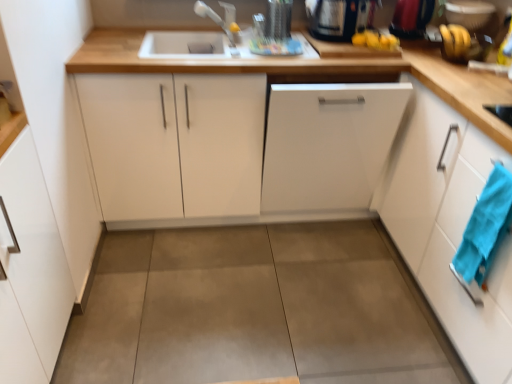
Question: From a real-world perspective, is white matte dishwasher at center, positioned as the 2th cabinetry in right-to-left order, above or below white glossy cabinet at right, arranged as the fourth cabinetry when viewed from the left?

Choices:
 (A) below
 (B) above

Answer: (A)

Question: From their relative heights in the image, would you say white matte dishwasher at center, the third cabinetry viewed from the left, is taller or shorter than white glossy cabinet at right, arranged as the fourth cabinetry when viewed from the left?

Choices:
 (A) short
 (B) tall

Answer: (A)

Question: Considering the real-world distances, which object is closest to the white matte dishwasher at center, positioned as the 2th cabinetry in right-to-left order?

Choices:
 (A) white glossy cabinet at center, the third cabinetry positioned from the right
 (B) matte plastic bananas at upper right, positioned as the first appliance in right-to-left order
 (C) white glossy cabinet at right, which is the 1th cabinetry from right to left
 (D) white glossy cabinet at lower left, placed as the fourth cabinetry when sorted from right to left
 (E) black glossy kettle at upper right, which ranks as the 1th appliance in left-to-right order

Answer: (A)

Question: Which is farther from the white glossy cabinet at lower left, positioned as the first cabinetry in left-to-right order?

Choices:
 (A) concretesmoothfloor at center
 (B) matte plastic bananas at upper right, positioned as the first appliance in right-to-left order
 (C) black glossy kettle at upper right, which appears as the 3th appliance when viewed from the right
 (D) white glossy cabinet at right, arranged as the fourth cabinetry when viewed from the left
 (E) matte silver faucet at upper center

Answer: (B)